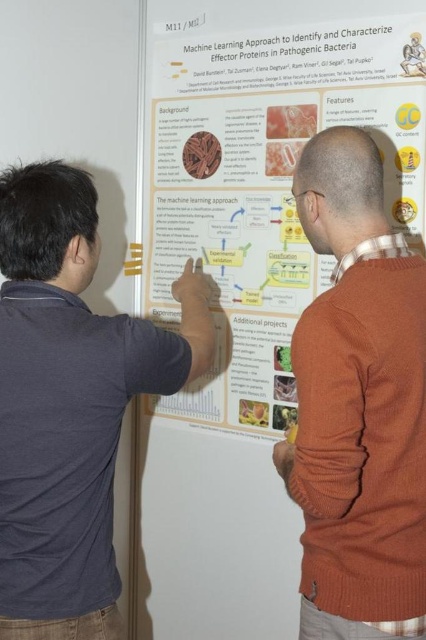
Between dark blue shirt at left and orange sweater at right, which one is positioned higher?

Positioned higher is orange sweater at right.

Between dark blue shirt at left and orange sweater at right, which one is positioned lower?

dark blue shirt at left is below.

Does point (34, 230) come farther from viewer compared to point (394, 429)?

Yes, point (34, 230) is behind point (394, 429).

Where is `dark blue shirt at left`? This screenshot has height=640, width=426. dark blue shirt at left is located at coordinates (69, 401).

Who is taller, white paper poster at center or orange sweater at right?

Standing taller between the two is white paper poster at center.

Between white paper poster at center and orange sweater at right, which one is positioned lower?

orange sweater at right

Who is more distant from viewer, (278, 360) or (356, 180)?

Point (278, 360)

I want to click on white paper poster at center, so click(247, 275).

Who is lower down, white paper poster at center or dark blue shirt at left?

dark blue shirt at left is below.

Locate an element on the screen. This screenshot has height=640, width=426. white paper poster at center is located at coordinates (247, 275).

Which is behind, point (270, 524) or point (63, 252)?

Positioned behind is point (270, 524).

In order to click on white paper poster at center in this screenshot , I will do pyautogui.click(x=247, y=275).